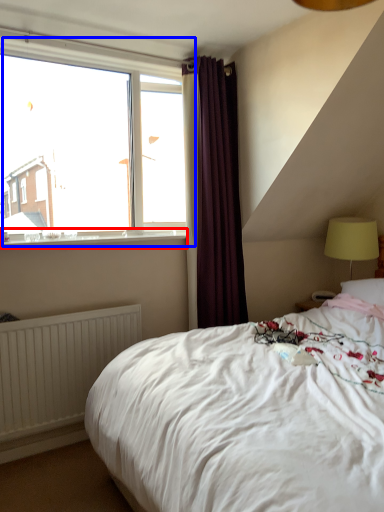
Question: Which object appears farthest to the camera in this image, window sill (highlighted by a red box) or window (highlighted by a blue box)?

Choices:
 (A) window sill
 (B) window

Answer: (B)